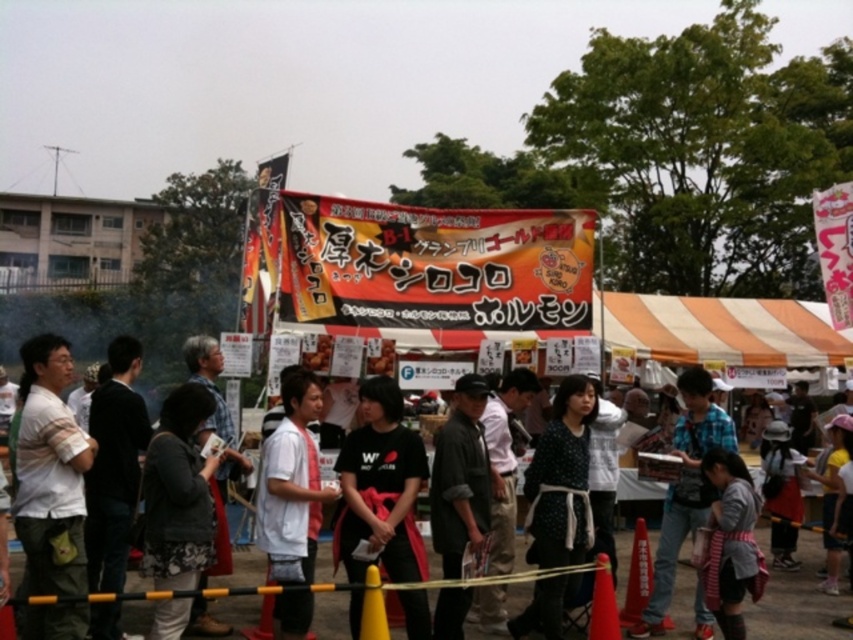
Question: Considering the relative positions of white cotton shirt at center and polka dot fabric dress at center in the image provided, where is white cotton shirt at center located with respect to polka dot fabric dress at center?

Choices:
 (A) below
 (B) above

Answer: (A)

Question: Does orange striped canopy at center have a lesser width compared to yellow plastic traffic cone at lower center?

Choices:
 (A) yes
 (B) no

Answer: (B)

Question: Can you confirm if white matte shirt at center is positioned below orange plastic traffic cone at center?

Choices:
 (A) no
 (B) yes

Answer: (A)

Question: Which point is closer to the camera?

Choices:
 (A) polka dot fabric dress at center
 (B) yellow plastic traffic cone at lower center
 (C) dark gray fabric jacket at center

Answer: (B)

Question: Which object is the farthest from the orange matte traffic cone at lower center?

Choices:
 (A) white striped shirt at left
 (B) dark gray fabric jacket at lower left

Answer: (A)

Question: Estimate the real-world distances between objects in this image. Which object is farther from the orange striped canopy at center?

Choices:
 (A) white striped shirt at left
 (B) dark gray fabric jacket at lower left
 (C) black matte shirt at center
 (D) dark gray fabric jacket at center

Answer: (A)